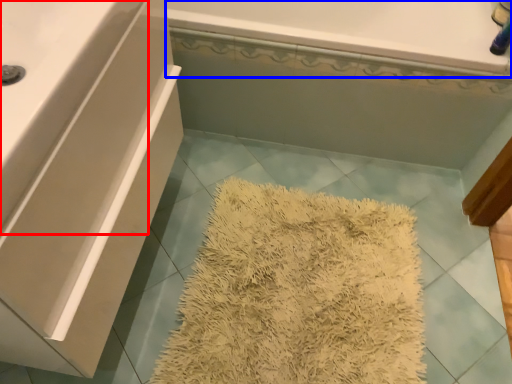
Question: Which of the following is the closest to the observer, counter top (highlighted by a red box) or bath (highlighted by a blue box)?

Choices:
 (A) counter top
 (B) bath

Answer: (A)